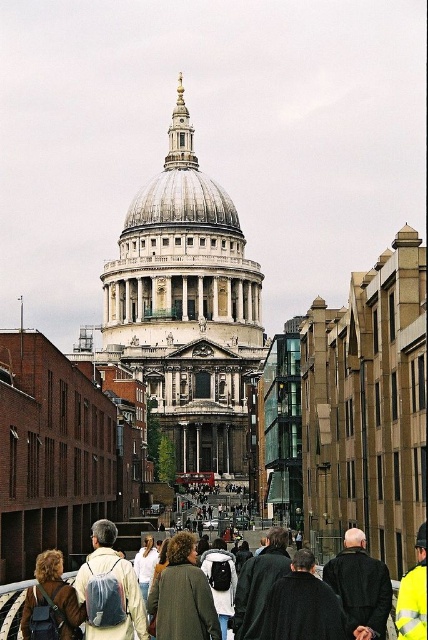
Question: Which point is farther to the camera?

Choices:
 (A) (53, 589)
 (B) (403, 618)
 (C) (374, 609)

Answer: (C)

Question: Can you confirm if white marble cathedral at center is thinner than dark brown leather coat at center?

Choices:
 (A) yes
 (B) no

Answer: (B)

Question: Which of the following is the farthest from the observer?

Choices:
 (A) (24, 630)
 (B) (329, 570)
 (C) (237, 413)
 (D) (424, 536)

Answer: (C)

Question: Does white marble cathedral at center have a smaller size compared to yellow reflective jacket at center?

Choices:
 (A) yes
 (B) no

Answer: (B)

Question: Which object is positioned closest to the brown leather backpack at lower left?

Choices:
 (A) white marble cathedral at center
 (B) yellow reflective jacket at center
 (C) dark brown leather coat at center

Answer: (C)

Question: Can you confirm if brown leather backpack at lower left is positioned to the right of yellow reflective jacket at center?

Choices:
 (A) yes
 (B) no

Answer: (B)